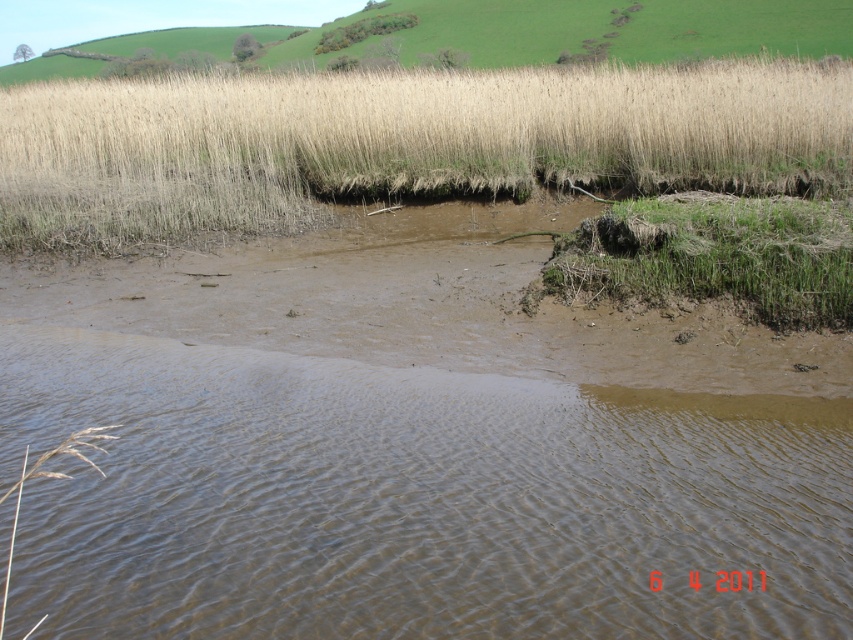
Can you confirm if golden straw grass at upper center is shorter than green grassy patch at lower right?

Incorrect, golden straw grass at upper center's height does not fall short of green grassy patch at lower right's.

Can you confirm if golden straw grass at upper center is positioned to the left of green grassy patch at lower right?

Indeed, golden straw grass at upper center is positioned on the left side of green grassy patch at lower right.

Where is `golden straw grass at upper center`? The image size is (853, 640). golden straw grass at upper center is located at coordinates (544, 33).

Where is `golden straw grass at upper center`? Image resolution: width=853 pixels, height=640 pixels. golden straw grass at upper center is located at coordinates (544, 33).

Between point (842, 132) and point (778, 305), which one is positioned behind?

The point (842, 132) is behind.

Does point (76, 141) come behind point (813, 209)?

Yes, point (76, 141) is behind point (813, 209).

I want to click on dry grass at upper center, so click(x=399, y=141).

What are the coordinates of `dry grass at upper center` in the screenshot? It's located at (399, 141).

Does dry grass at upper center lie in front of golden straw grass at upper center?

That is True.

Where is `dry grass at upper center`? The width and height of the screenshot is (853, 640). dry grass at upper center is located at coordinates (399, 141).